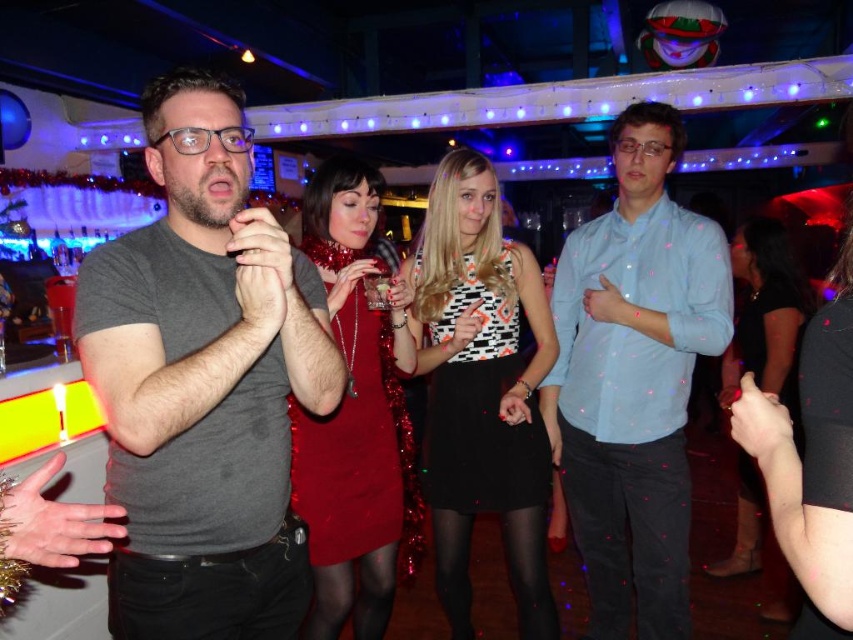
Question: Can you confirm if printed cotton dress at center is wider than black satin dress at lower right?

Choices:
 (A) no
 (B) yes

Answer: (A)

Question: Is printed cotton dress at center to the left of black satin dress at lower right from the viewer's perspective?

Choices:
 (A) no
 (B) yes

Answer: (B)

Question: Among these objects, which one is farthest from the camera?

Choices:
 (A) printed cotton dress at center
 (B) black satin dress at lower right
 (C) gray matte t-shirt at left
 (D) light blue shirt at center

Answer: (B)

Question: Estimate the real-world distances between objects in this image. Which object is closer to the black satin dress at lower right?

Choices:
 (A) printed cotton dress at center
 (B) light blue shirt at center
 (C) gray matte t-shirt at left
 (D) shiny red dress at center

Answer: (B)

Question: Does light blue shirt at center have a greater width compared to shiny red dress at center?

Choices:
 (A) no
 (B) yes

Answer: (B)

Question: Which point is farther to the camera?

Choices:
 (A) printed cotton dress at center
 (B) light blue shirt at center
 (C) shiny red dress at center
 (D) black satin dress at lower right

Answer: (D)